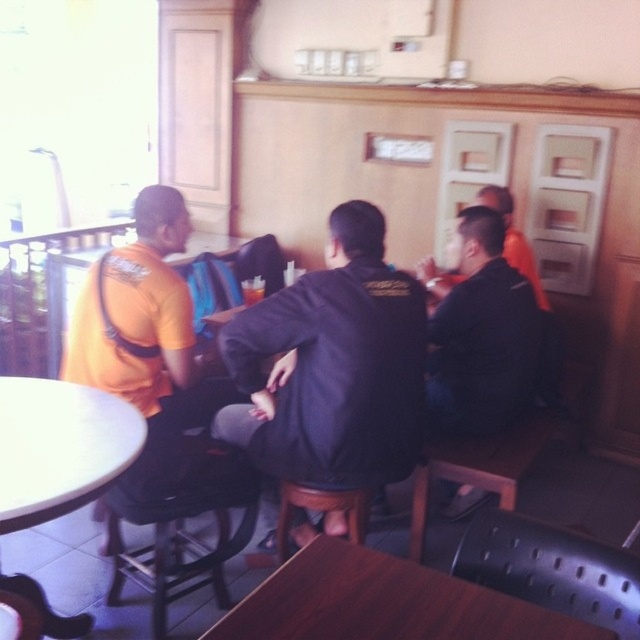
Question: Which point appears farthest from the camera in this image?

Choices:
 (A) (96, 429)
 (B) (500, 225)
 (C) (524, 237)

Answer: (C)

Question: Which of the following is the farthest from the observer?

Choices:
 (A) (483, 433)
 (B) (24, 460)
 (C) (524, 547)

Answer: (A)

Question: Is the position of wooden table at center less distant than that of dark blue jacket at center?

Choices:
 (A) yes
 (B) no

Answer: (A)

Question: Is wooden table at center thinner than white glossy round table at lower left?

Choices:
 (A) no
 (B) yes

Answer: (A)

Question: Can you confirm if orange matte shirt at left is bigger than white glossy round table at lower left?

Choices:
 (A) no
 (B) yes

Answer: (B)

Question: Which point appears closest to the camera in this image?

Choices:
 (A) (392, 604)
 (B) (356, 332)

Answer: (A)